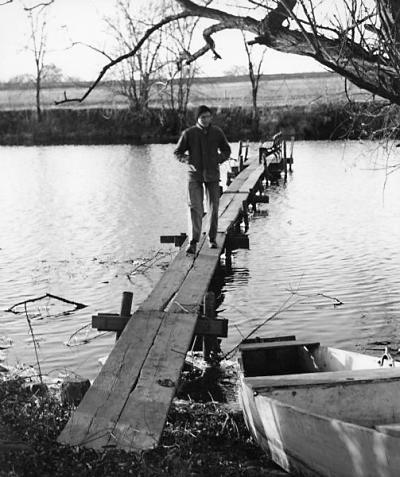
This screenshot has height=477, width=400. Identify the location of seats. (334, 377), (289, 344).